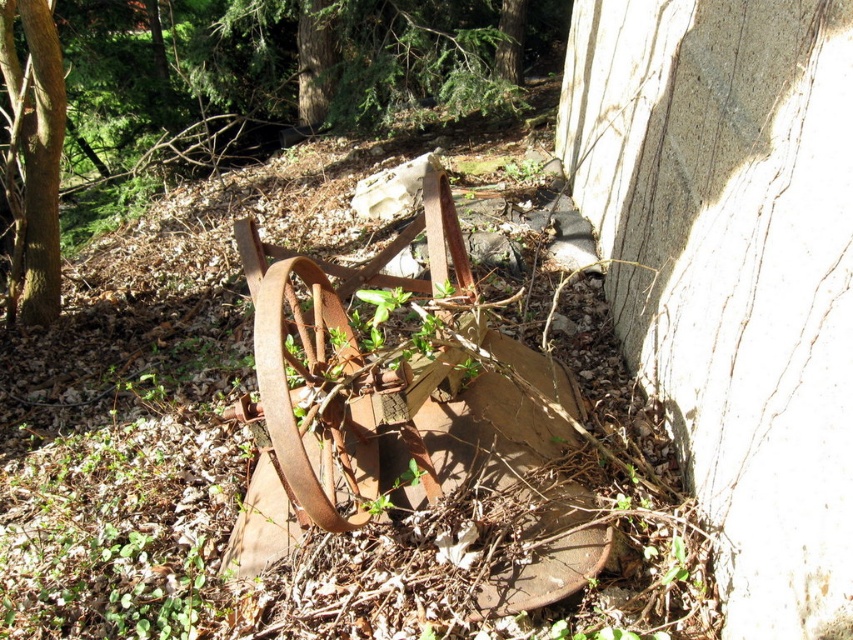
You are a painter standing in front of the rusty metal wagon wheel at center and the green rough bark tree at left. You want to paint both subjects. Which one will you need to look up more to paint?

The green rough bark tree at left is taller than the rusty metal wagon wheel at center, so you will need to look up more to paint the green rough bark tree at left.

You are a hiker navigating through the woods and spot the green rough bark tree at left and the green matte tree at upper center. Which tree is positioned lower in the scene?

The green rough bark tree at left is located below the green matte tree at upper center, so it is positioned lower in the scene.

You are a park maintenance worker who needs to transport a 3.0 meter long wooden plank from the rusty metal wagon wheel at center to the green rough bark tree at left. Can you move the plank horizontally between them without tilting it?

The distance between the rusty metal wagon wheel at center and the green rough bark tree at left is 3.16 meters. Since the plank is 3.0 meters long, it can be moved horizontally between them without tilting as the distance is slightly longer than the plank.